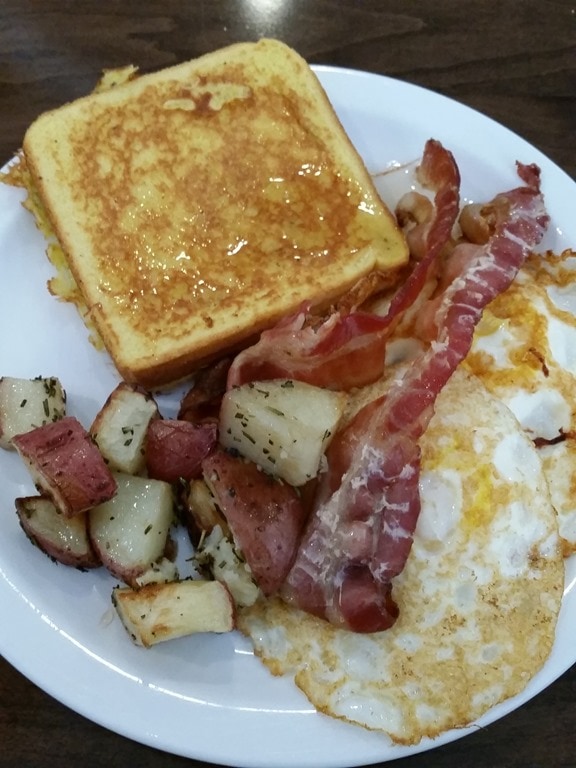
Find the location of a particular element. The height and width of the screenshot is (768, 576). white plate is located at coordinates (249, 697).